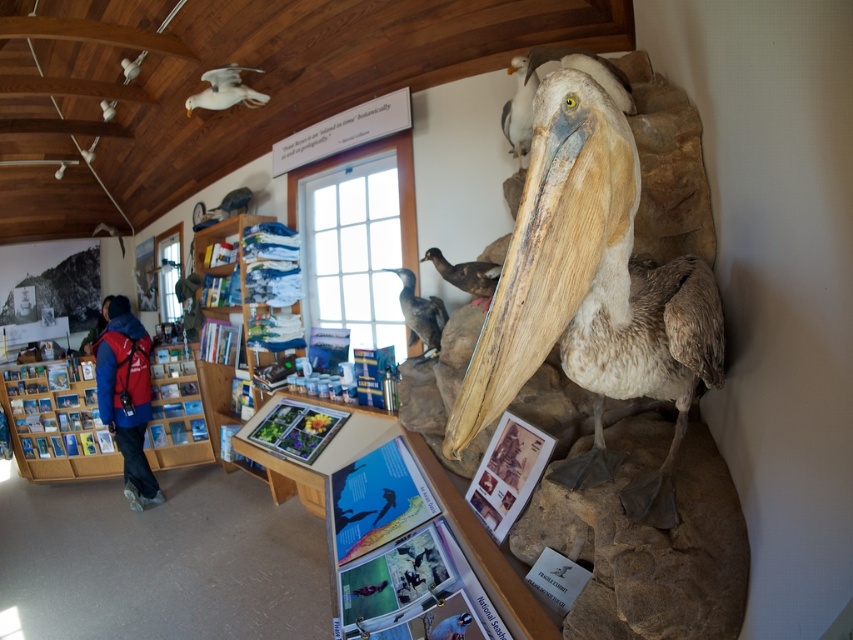
Does blue glossy bird at lower center come in front of white matte dove at upper left?

Yes, blue glossy bird at lower center is closer to the viewer.

Does blue glossy bird at lower center have a smaller size compared to white matte dove at upper left?

Correct, blue glossy bird at lower center occupies less space than white matte dove at upper left.

At what (x,y) coordinates should I click in order to perform the action: click on blue glossy bird at lower center. Please return your answer as a coordinate pair (x, y). This screenshot has width=853, height=640. Looking at the image, I should click on (451, 627).

Who is positioned more to the right, white matte bird at upper left or brown matte duck at center?

brown matte duck at center

Based on the photo, which is more to the left, white matte bird at upper left or brown matte duck at center?

white matte bird at upper left is more to the left.

Does point (231, 77) come closer to viewer compared to point (442, 276)?

No.

At what (x,y) coordinates should I click in order to perform the action: click on white matte bird at upper left. Please return your answer as a coordinate pair (x, y). This screenshot has width=853, height=640. Looking at the image, I should click on (225, 90).

Is dark gray matte bird at center below brown matte duck at center?

Correct, dark gray matte bird at center is located below brown matte duck at center.

Can you confirm if dark gray matte bird at center is thinner than brown matte duck at center?

Correct, dark gray matte bird at center's width is less than brown matte duck at center's.

Locate an element on the screen. Image resolution: width=853 pixels, height=640 pixels. dark gray matte bird at center is located at coordinates (421, 314).